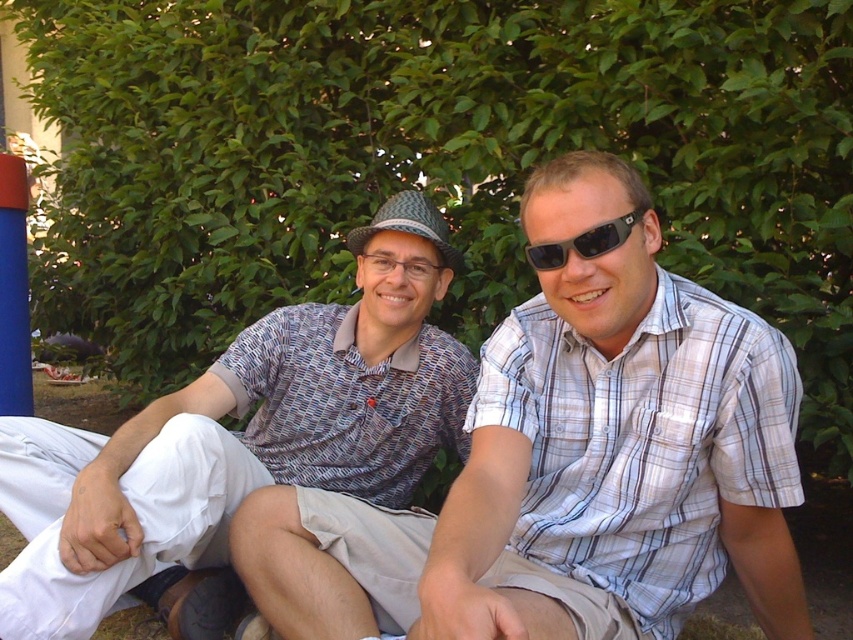
Looking at this image, you are a photographer trying to capture a closeup of the white cotton shirt at center and the black plastic sunglasses at center. Given that your camera can focus on objects within a 12 inch range, will you need to adjust your focus to include both items?

The distance between the white cotton shirt at center and the black plastic sunglasses at center is 13.84 inches. Since this exceeds the camera focus range of 12 inches, you will need to adjust your focus to include both items.

You are organizing a clothing display and need to arrange the white cotton shirt at center and the patterned fabric shirt at center based on their sizes. Which shirt should you place first if you want to start with the larger one?

The patterned fabric shirt at center should be placed first because it occupies more space than the white cotton shirt at center according to the description.

You are a photographer trying to capture a closeup of the patterned fabric shirt at center. You have a camera with a zoom lens that can focus on a specific point. The point you need to focus on is at coordinates point (242, 435). Based on the scene description, can you confirm if this point is on the correct object?

Yes, the point (242, 435) is on the patterned fabric shirt at center, so focusing there will capture the desired object.